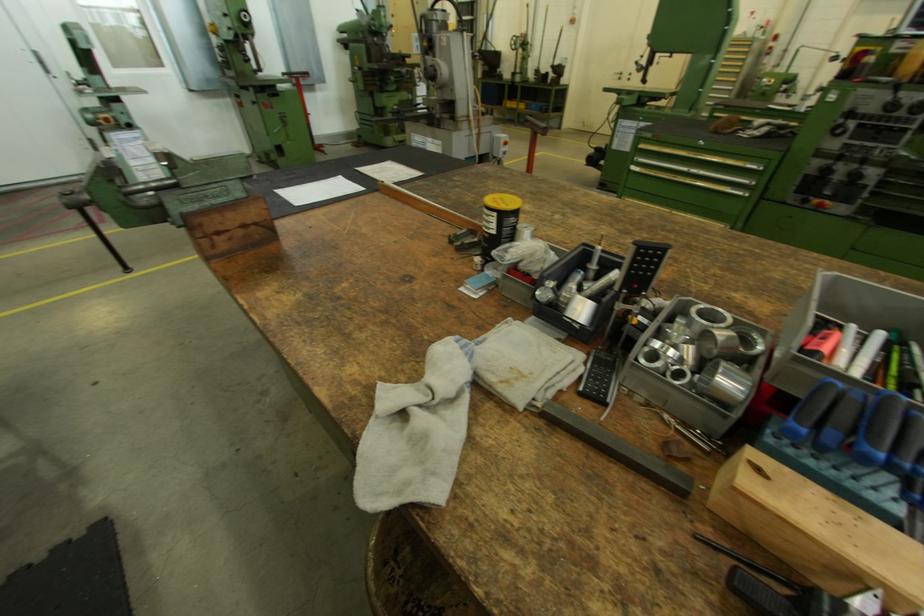
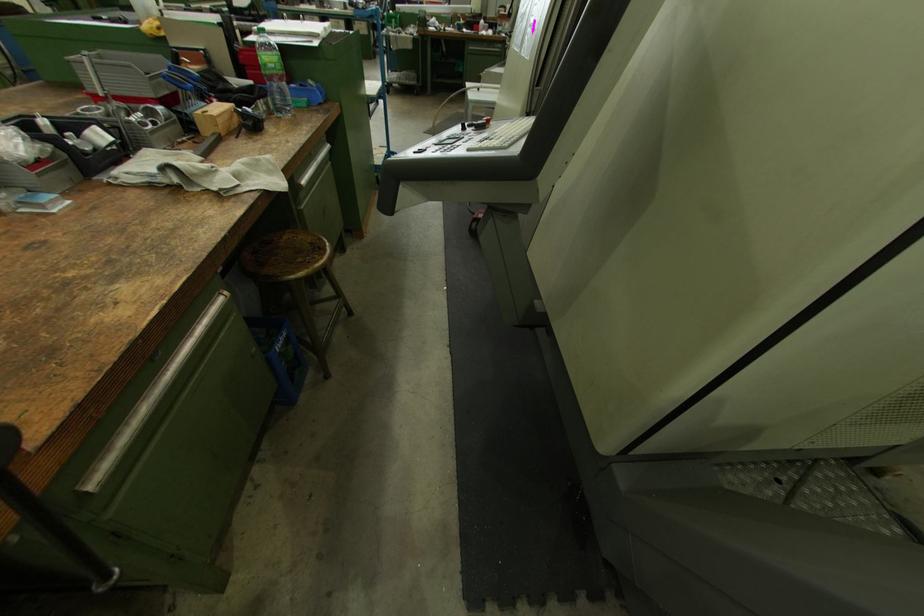
Locate, in the second image, the point that corresponds to [774,440] in the first image.

(192, 113)